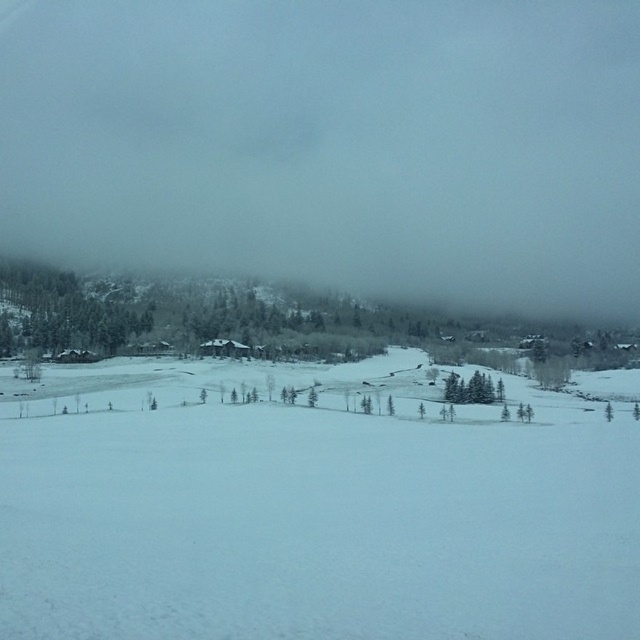
The image size is (640, 640). What do you see at coordinates (332, 145) in the screenshot?
I see `white fog at upper center` at bounding box center [332, 145].

Is white fog at upper center above white snow ski slope at center?

Correct, white fog at upper center is located above white snow ski slope at center.

Locate an element on the screen. Image resolution: width=640 pixels, height=640 pixels. white fog at upper center is located at coordinates (332, 145).

You are a GUI agent. You are given a task and a screenshot of the screen. Output one action in this format:
    pyautogui.click(x=<x>, y=<y>)
    Task: Click on the white fog at upper center
    Image resolution: width=640 pixels, height=640 pixels.
    Given the screenshot: What is the action you would take?
    332,145